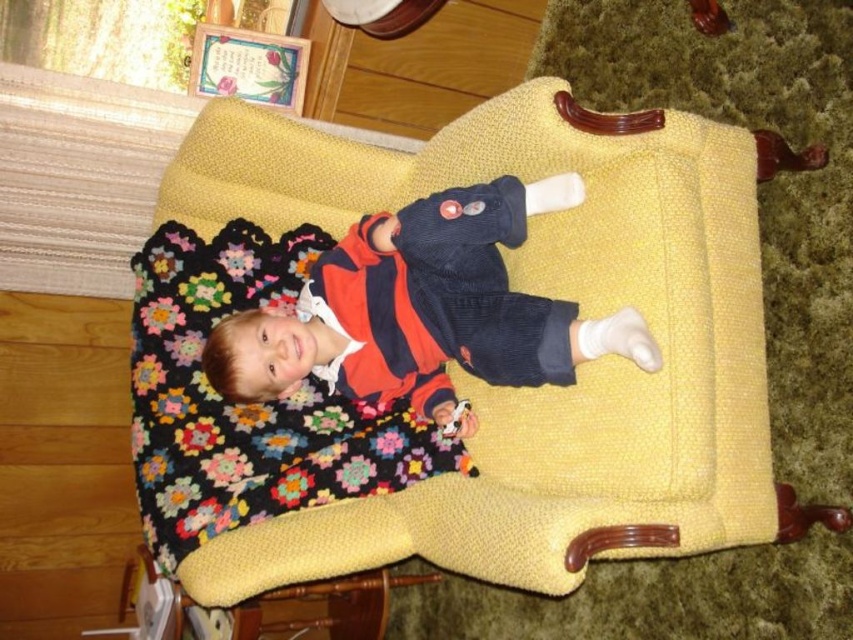
You are a photographer setting up a shot of the child in the yellow armchair. You have two markers to indicate where to place your lights. The first marker is at point [268,348] and the second at point [173,412]. Which marker is closer to the camera?

Point [268,348] is in front of point [173,412], so the first marker is closer to the camera.

You are a photographer setting up a shoot in this room. You need to ensure that the matte corduroy sweater at center and the multicolored knitted blanket at center are both visible in the final photo. Based on their positions, which object is covering part of the other?

The matte corduroy sweater at center is positioned over the multicolored knitted blanket at center, so the sweater is covering part of the blanket.

You are a parent trying to decide which item to store first. The matte corduroy sweater at center and the multicolored knitted blanket at center are both on the chair. Which item is shorter in height?

The matte corduroy sweater at center is shorter in height compared to the multicolored knitted blanket at center.